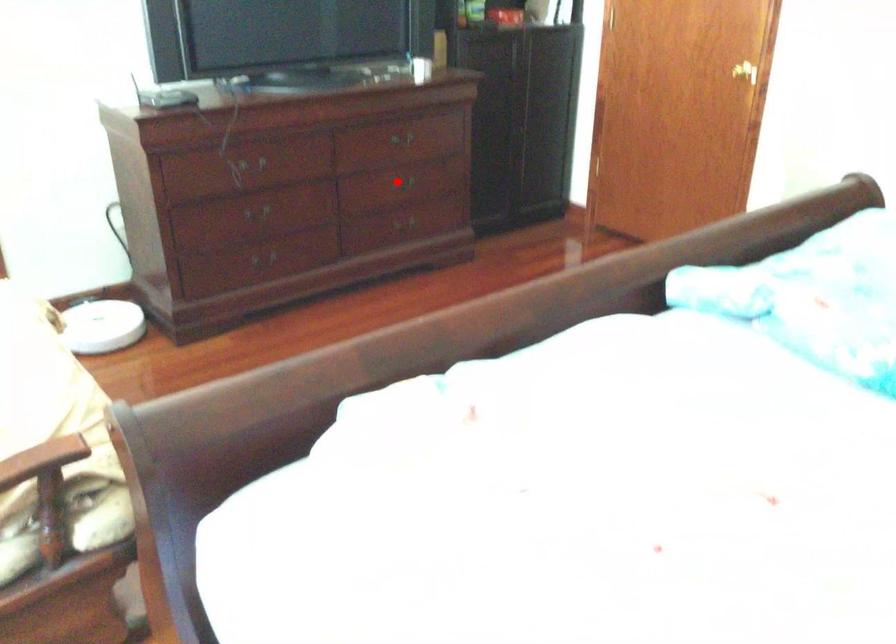
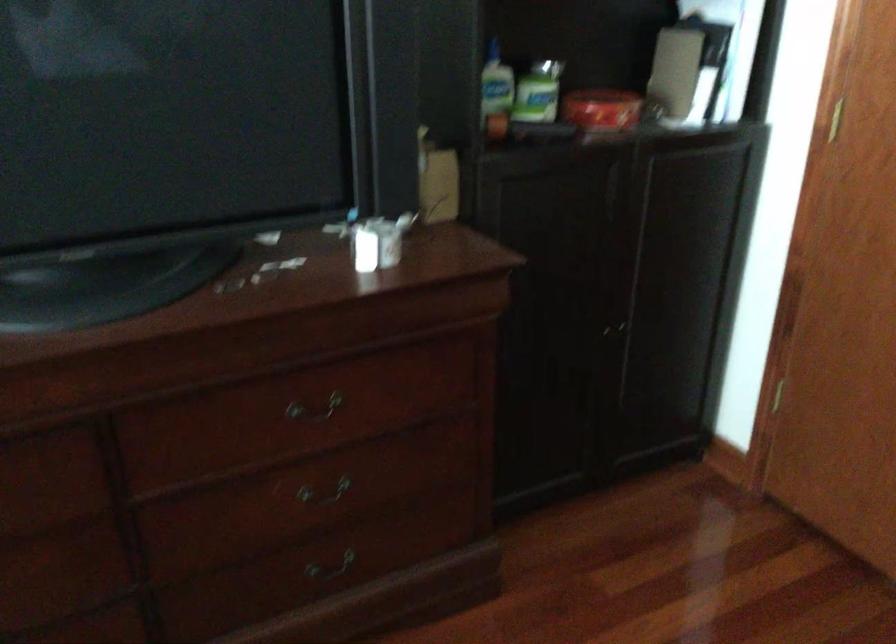
Find the pixel in the second image that matches the highlighted location in the first image.

(323, 491)